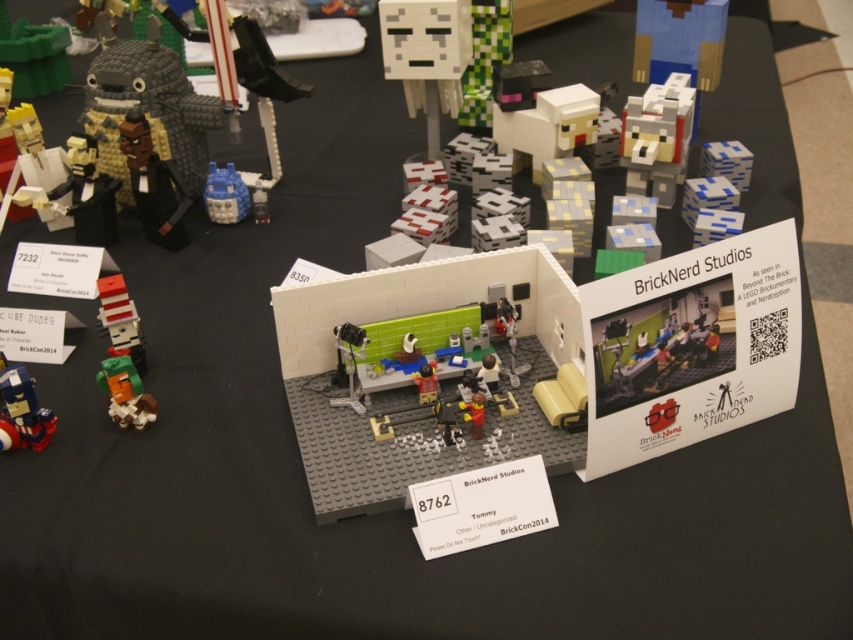
Does shiny blue plastic robot at lower left appear on the left side of green matte creeper at lower left?

Correct, you'll find shiny blue plastic robot at lower left to the left of green matte creeper at lower left.

At what (x,y) coordinates should I click in order to perform the action: click on shiny blue plastic robot at lower left. Please return your answer as a coordinate pair (x, y). Looking at the image, I should click on click(21, 410).

Identify the location of shiny blue plastic robot at lower left. Image resolution: width=853 pixels, height=640 pixels. (21, 410).

Is point (120, 410) more distant than point (213, 211)?

No, (120, 410) is closer to viewer.

Is point (123, 426) positioned in front of point (221, 192)?

Yes, it is.

I want to click on green matte creeper at lower left, so click(x=125, y=392).

Which is in front, point (138, 332) or point (222, 189)?

Point (138, 332) is in front.

Is point (138, 336) positioned in front of point (218, 193)?

Yes.

The width and height of the screenshot is (853, 640). What are the coordinates of `matte red brick at left` in the screenshot? It's located at (x=120, y=320).